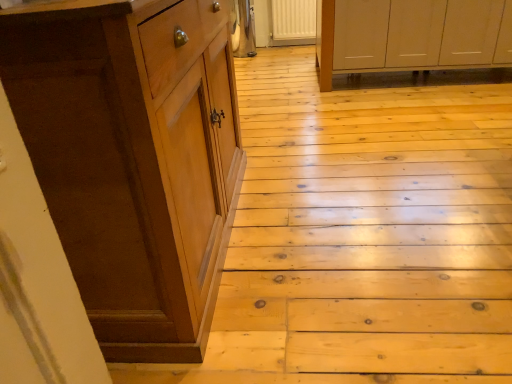
Locate an element on the screen. The height and width of the screenshot is (384, 512). vacant space that's between white matte cabinet at upper right, positioned as the 2th cabinetry in left-to-right order, and brown wood cabinet at left, which is the 2th cabinetry in top-to-bottom order is located at coordinates tap(361, 147).